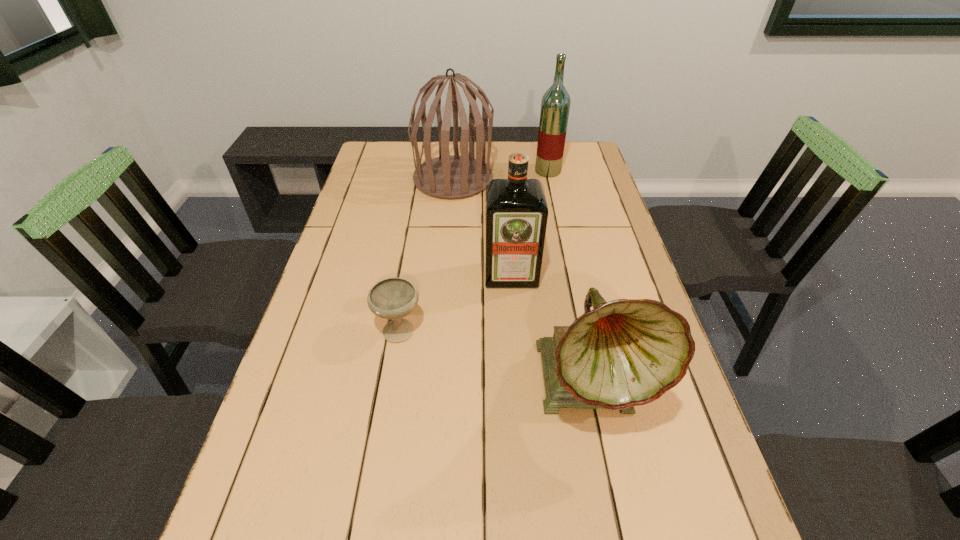
At what (x,y) coordinates should I click in order to perform the action: click on free location located on the back of the chalice. Please return your answer as a coordinate pair (x, y). The image size is (960, 540). Looking at the image, I should click on (410, 264).

Where is `liquor that is at the far edge`? The image size is (960, 540). liquor that is at the far edge is located at coordinates (555, 105).

Locate an element on the screen. The image size is (960, 540). birdcage situated at the far edge is located at coordinates (448, 176).

I want to click on liquor positioned at the right edge, so click(555, 105).

Locate an element on the screen. record player present at the right edge is located at coordinates (628, 352).

At what (x,y) coordinates should I click in order to perform the action: click on object that is at the far right corner. Please return your answer as a coordinate pair (x, y). This screenshot has height=540, width=960. Looking at the image, I should click on (555, 105).

In the image, there is a desktop. Where is `vacant space at the far edge`? vacant space at the far edge is located at coordinates (530, 147).

Image resolution: width=960 pixels, height=540 pixels. In the image, there is a desktop. What are the coordinates of `vacant space at the left edge` in the screenshot? It's located at [x=325, y=489].

The image size is (960, 540). In the image, there is a desktop. Identify the location of vacant area at the right edge. (604, 181).

Locate an element on the screen. vacant space at the far left corner is located at coordinates (364, 168).